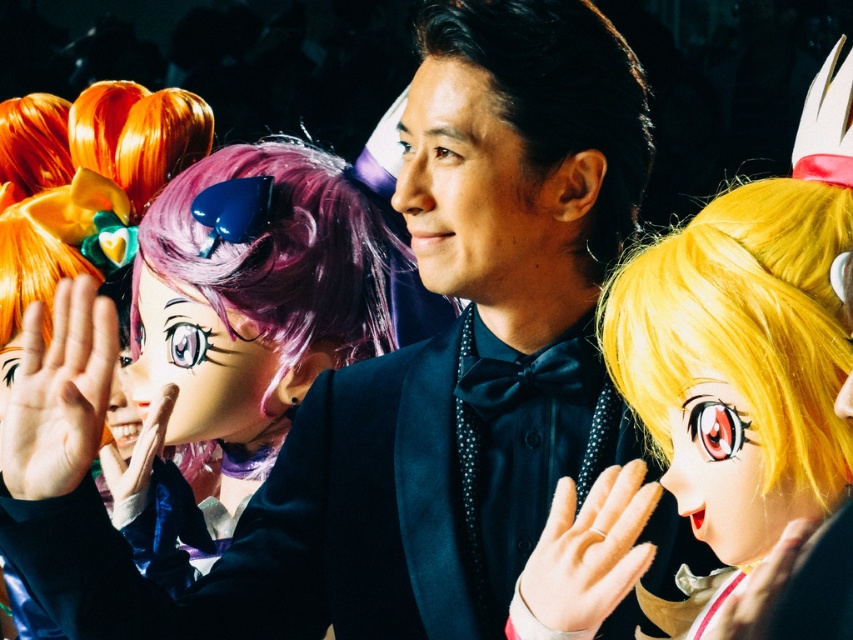
Question: Does smooth skin face at center have a larger size compared to smooth plastic mask at center?

Choices:
 (A) yes
 (B) no

Answer: (A)

Question: Is smooth skin face at center in front of shiny gold wig at center?

Choices:
 (A) yes
 (B) no

Answer: (B)

Question: Does shiny purple wig at center have a larger size compared to smooth skin face at center?

Choices:
 (A) yes
 (B) no

Answer: (A)

Question: Which object is positioned farthest from the smooth plastic mask at center?

Choices:
 (A) black shiny hair at center
 (B) shiny gold wig at center
 (C) shiny blonde wig at center
 (D) purple matte wig at center

Answer: (B)

Question: Among these objects, which one is nearest to the camera?

Choices:
 (A) black shiny hair at center
 (B) shiny gold wig at center
 (C) shiny blonde wig at center

Answer: (C)

Question: Among these objects, which one is nearest to the camera?

Choices:
 (A) black shiny hair at center
 (B) shiny gold wig at center

Answer: (B)